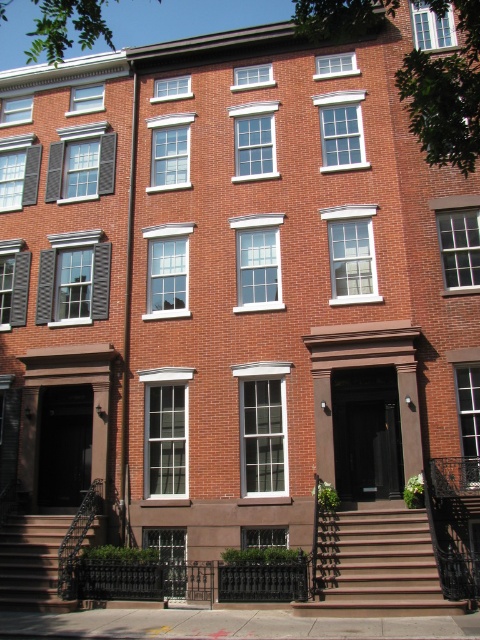
You are standing in front of the townhouses and want to go up the stairs. Which set of stairs, the brown wooden stairs at center or the brown wooden stairs at lower left, is higher up and closer to the entrance?

The brown wooden stairs at center is above the brown wooden stairs at lower left, so it is higher up and closer to the entrance.

You are a delivery person trying to deliver a package to one of the townhouses. You need to choose between the brown wooden stairs at center and the brown wooden stairs at lower left. Which set of stairs has a wider path for carrying a large box?

The brown wooden stairs at center has a larger width than the brown wooden stairs at lower left, so it is the wider path for carrying a large box.